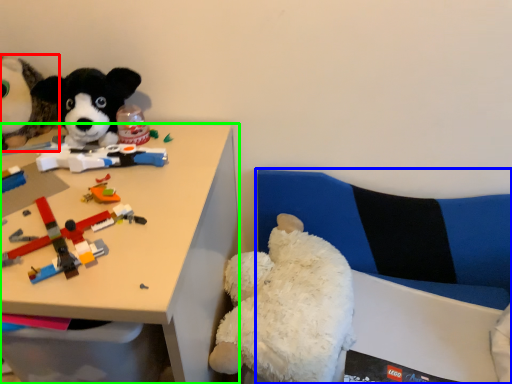
Question: Considering the real-world distances, which object is farthest from toy (highlighted by a red box)? couch (highlighted by a blue box) or desk (highlighted by a green box)?

Choices:
 (A) couch
 (B) desk

Answer: (A)